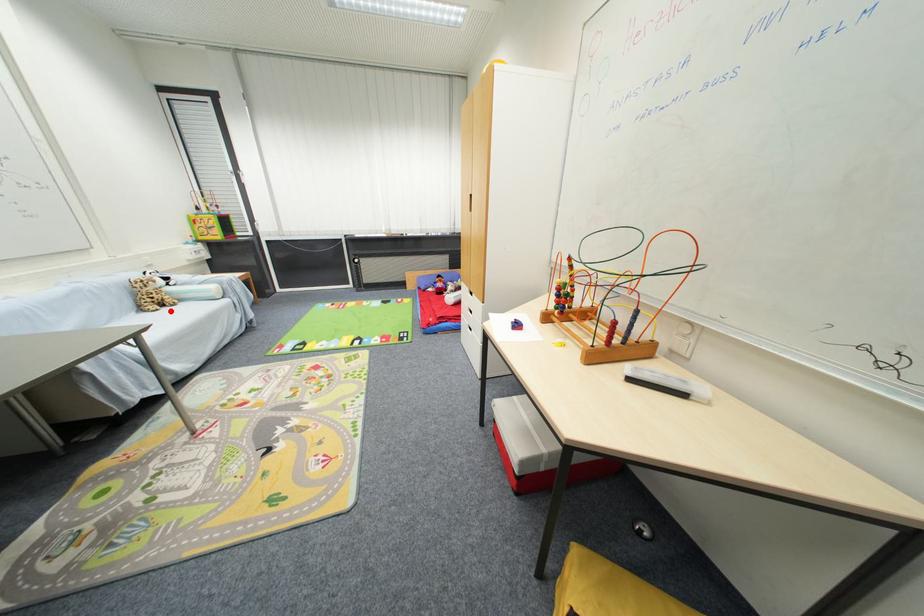
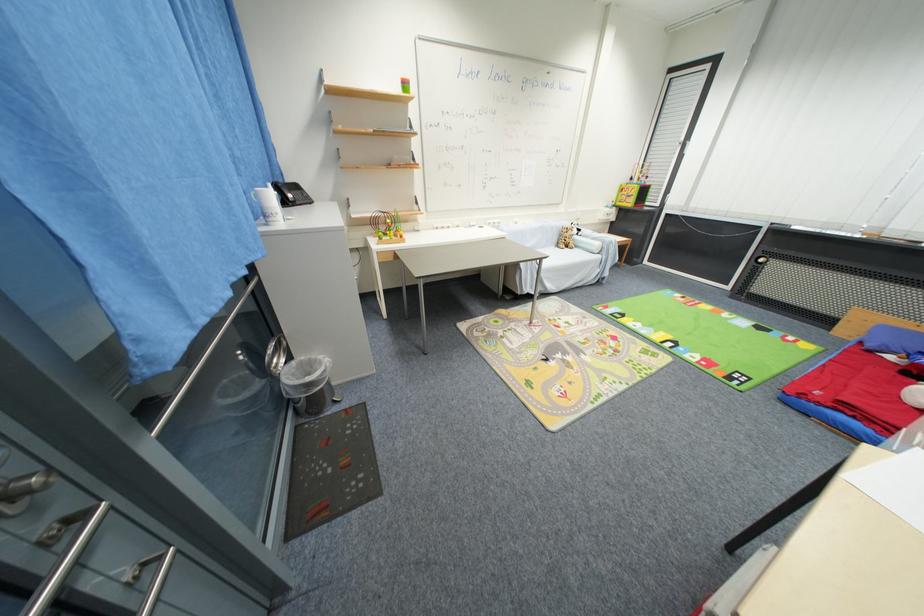
Where in the second image is the point corresponding to the highlighted location from the first image?

(572, 251)